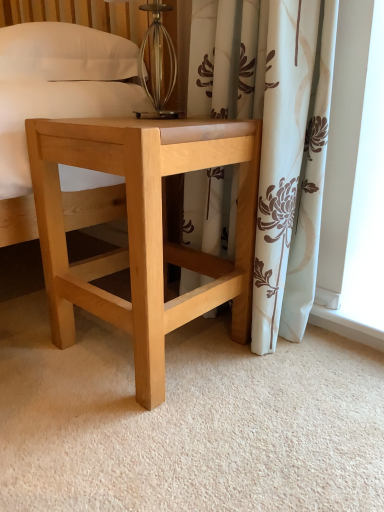
In order to face natural wood stool at center, should I rotate leftwards or rightwards?

Turn left approximately 5.350 degrees to face it.

What do you see at coordinates (143, 229) in the screenshot? I see `natural wood stool at center` at bounding box center [143, 229].

The height and width of the screenshot is (512, 384). Identify the location of natural wood stool at center. (143, 229).

The image size is (384, 512). I want to click on natural wood stool at center, so click(143, 229).